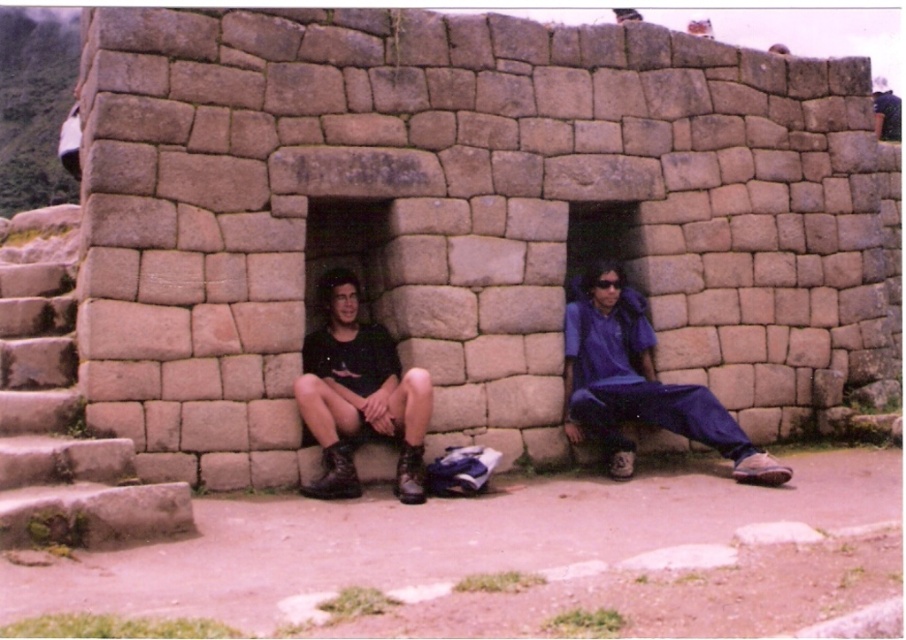
Question: Does dark blue fabric pants at center appear on the left side of blue fabric pants at right?

Choices:
 (A) yes
 (B) no

Answer: (A)

Question: Which object is the farthest from the rustic stone stairs at lower left?

Choices:
 (A) black matte boots at lower left
 (B) dark blue fabric pants at center

Answer: (A)

Question: Which point is farther from the camera taking this photo?

Choices:
 (A) (394, 426)
 (B) (614, 381)

Answer: (B)

Question: Is dark blue fabric pants at center above rustic stone stairs at lower left?

Choices:
 (A) yes
 (B) no

Answer: (A)

Question: Is blue fabric pants at right below black matte boots at lower left?

Choices:
 (A) no
 (B) yes

Answer: (B)

Question: Which of the following is the closest to the observer?

Choices:
 (A) (625, 404)
 (B) (345, 403)

Answer: (B)